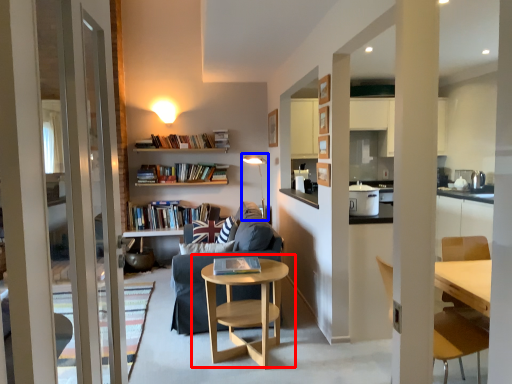
Question: Which point is closer to the camera, table (highlighted by a red box) or light fixture (highlighted by a blue box)?

Choices:
 (A) table
 (B) light fixture

Answer: (A)